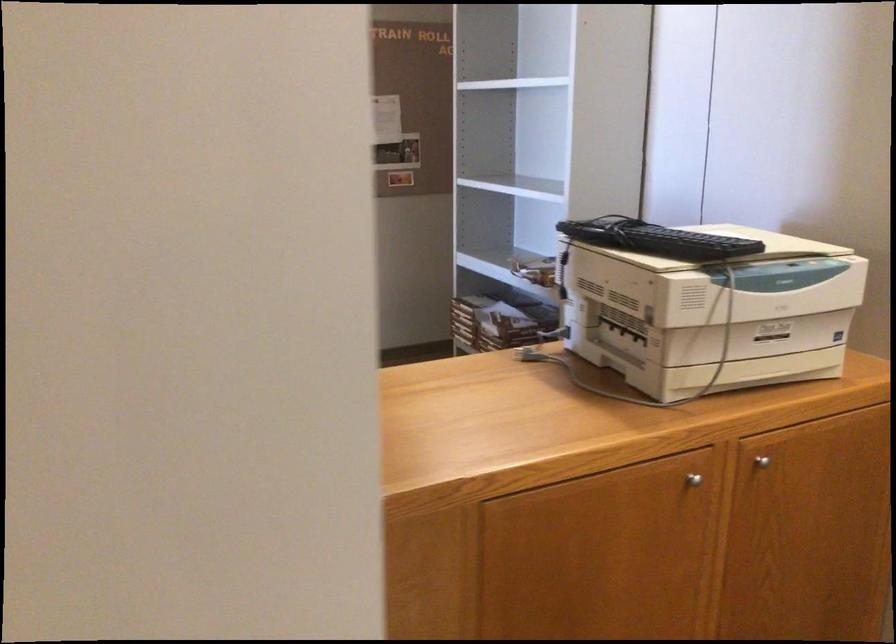
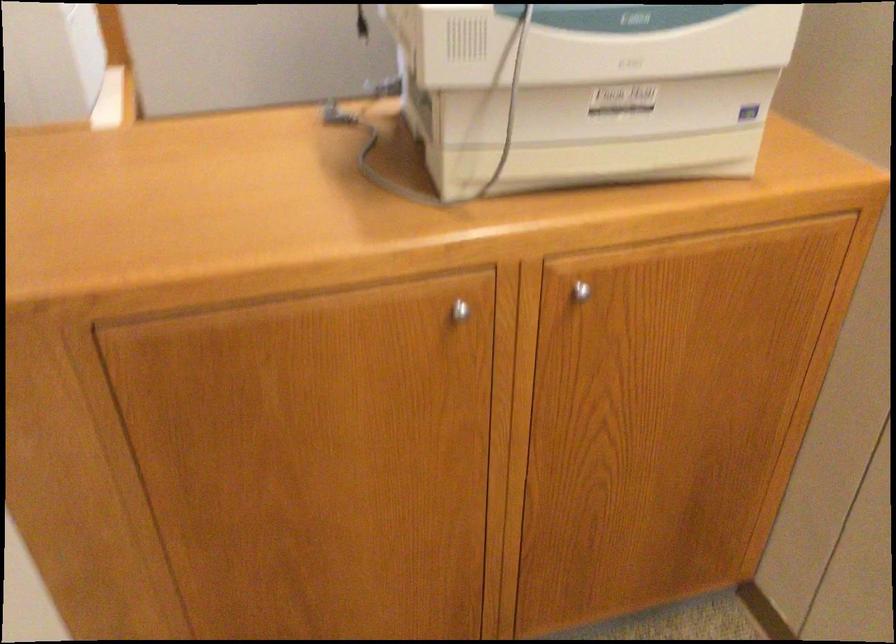
Question: What movement of the cameraman would produce the second image?

Choices:
 (A) Left
 (B) Right
 (C) Forward
 (D) Backward

Answer: (D)